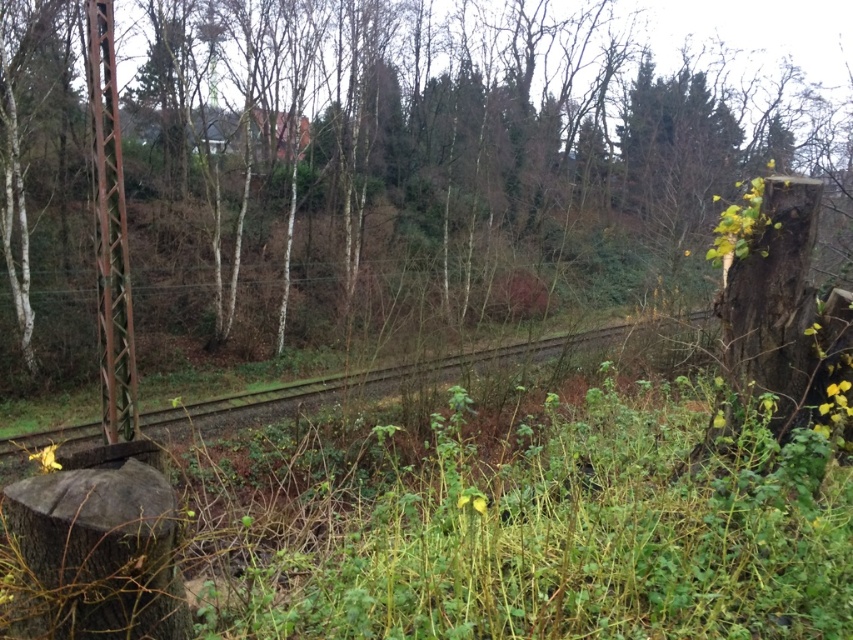
Question: Considering the relative positions of brown textured pole at left and brown gravel train track at center in the image provided, where is brown textured pole at left located with respect to brown gravel train track at center?

Choices:
 (A) above
 (B) below

Answer: (A)

Question: Which point is closer to the camera?

Choices:
 (A) (582, 134)
 (B) (115, 129)

Answer: (B)

Question: Is brown textured pole at left above brown gravel train track at center?

Choices:
 (A) yes
 (B) no

Answer: (A)

Question: Does brown textured pole at left have a smaller size compared to brown gravel train track at center?

Choices:
 (A) no
 (B) yes

Answer: (B)

Question: Considering the real-world distances, which object is closest to the smooth bark tree stump at left?

Choices:
 (A) brown gravel train track at center
 (B) brown textured pole at left

Answer: (A)

Question: Which point is closer to the camera?

Choices:
 (A) brown gravel train track at center
 (B) brown textured pole at left

Answer: (B)